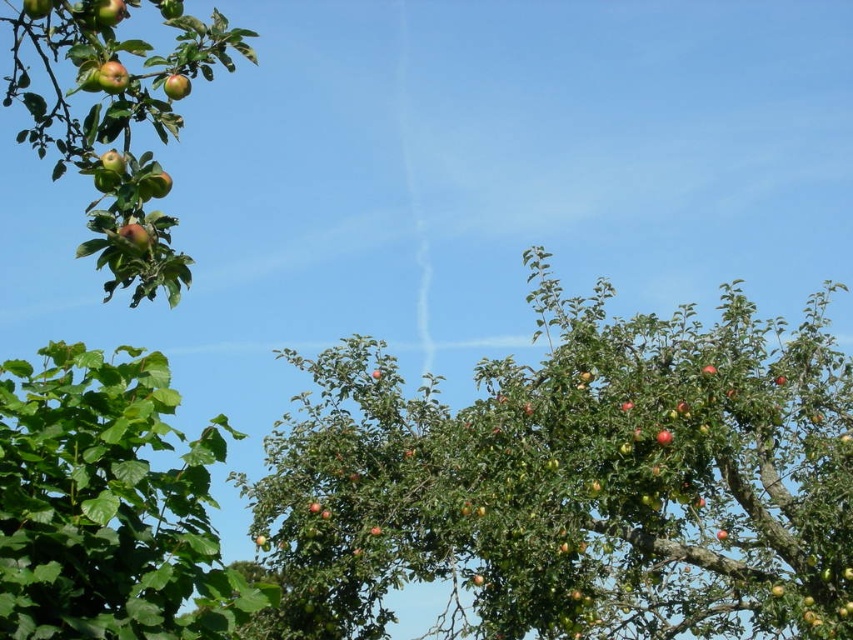
You are standing in the outdoor scene and want to pick an apple from the apple tree. There are two points marked in the image. The first point is at coordinates point (178, 616) and the second point is at point (175, 92). Which point is closer to you?

Point (178, 616) is closer to the camera than point (175, 92), so the first point is closer to you.